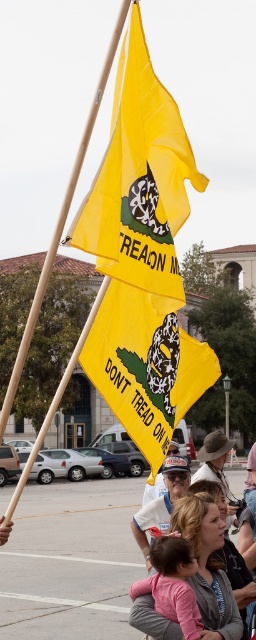
Is yellow matte flag at center bigger than white paper hat at center?

No.

Describe the element at coordinates (145, 365) in the screenshot. I see `yellow matte flag at center` at that location.

Describe the element at coordinates (145, 365) in the screenshot. The height and width of the screenshot is (640, 256). I see `yellow matte flag at center` at that location.

Locate an element on the screen. The image size is (256, 640). yellow matte flag at center is located at coordinates (145, 365).

Which is in front, point (161, 428) or point (209, 541)?

Point (161, 428)

Is the position of yellow matte flag at center less distant than that of pink fabric baby at lower center?

Yes, yellow matte flag at center is closer to the viewer.

Is point (163, 410) farther from viewer compared to point (151, 628)?

No, it is not.

You are a GUI agent. You are given a task and a screenshot of the screen. Output one action in this format:
    pyautogui.click(x=<x>, y=<y>)
    Task: Click on the yellow matte flag at center
    
    Given the screenshot: What is the action you would take?
    point(145,365)

Is wooden pole at upper center shorter than white paper hat at center?

No.

Between point (124, 0) and point (166, 492), which one is positioned in front?

Point (124, 0) is in front.

Is point (16, 369) farther from camera compared to point (148, 547)?

No, it is in front of (148, 547).

Image resolution: width=256 pixels, height=640 pixels. Identify the location of wooden pole at upper center. (60, 220).